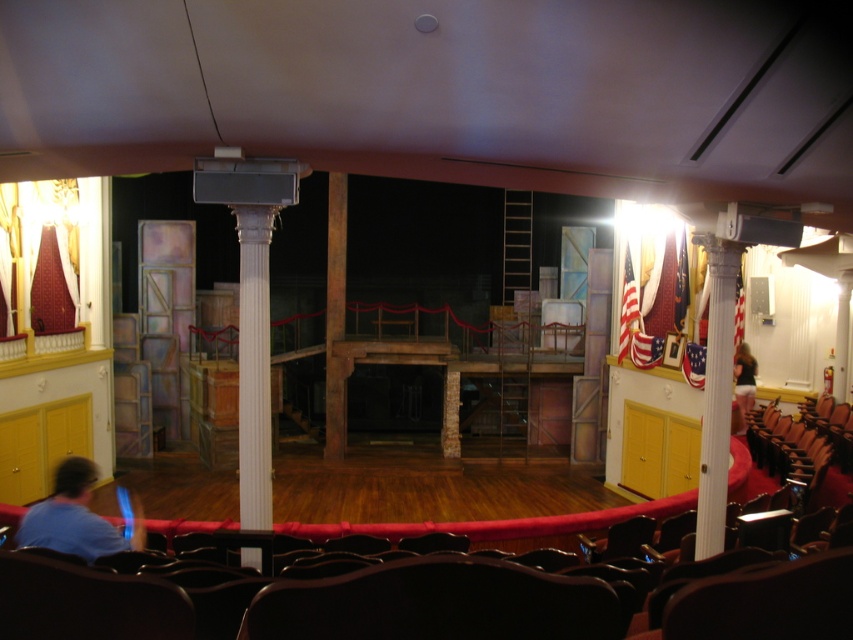
Question: Estimate the real-world distances between objects in this image. Which object is farther from the blue shirt at lower left?

Choices:
 (A) dark brown leather jacket at upper right
 (B) white glossy column at right

Answer: (A)

Question: Does blue shirt at lower left have a greater width compared to dark brown leather jacket at upper right?

Choices:
 (A) yes
 (B) no

Answer: (B)

Question: Does white glossy column at center have a greater width compared to white glossy column at right?

Choices:
 (A) no
 (B) yes

Answer: (A)

Question: Which of the following is the farthest from the observer?

Choices:
 (A) (733, 365)
 (B) (68, 481)
 (C) (717, 410)
 (D) (260, 349)

Answer: (A)

Question: Which object is positioned farthest from the white glossy column at right?

Choices:
 (A) dark brown leather jacket at upper right
 (B) white glossy column at center
 (C) blue shirt at lower left

Answer: (A)

Question: Is white glossy column at right smaller than dark brown leather jacket at upper right?

Choices:
 (A) yes
 (B) no

Answer: (A)